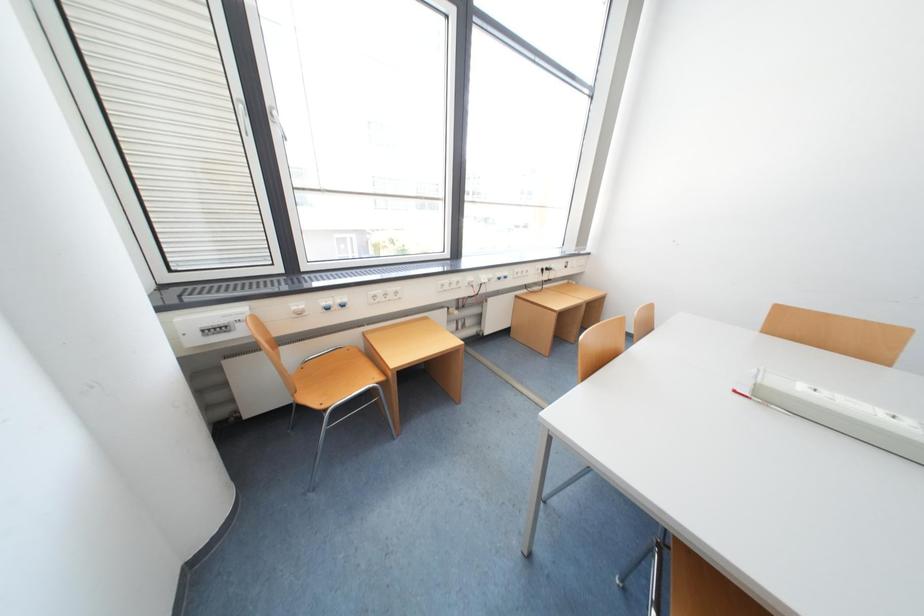
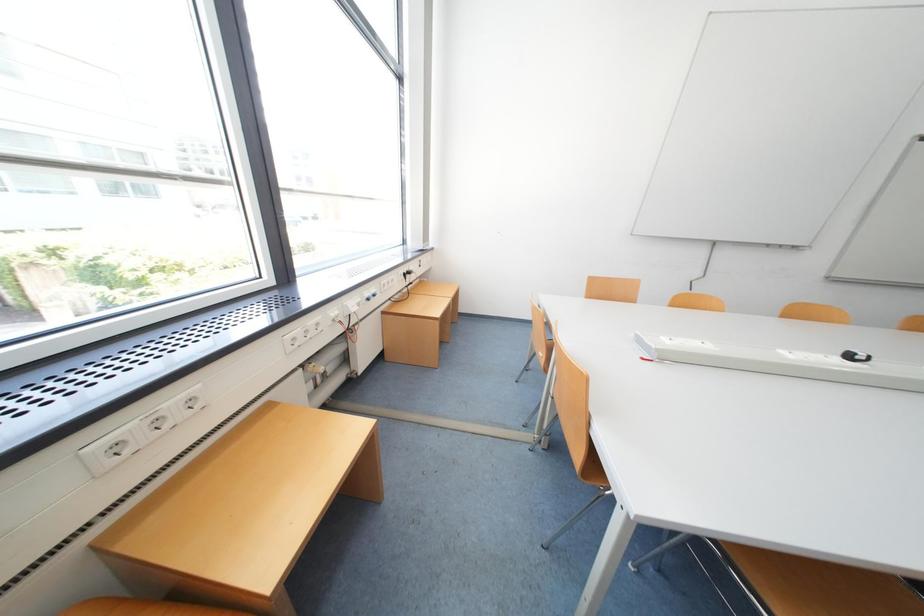
Question: The camera is either moving clockwise (left) or counter-clockwise (right) around the object. The first image is from the beginning of the video and the second image is from the end. Is the camera moving left or right when shooting the video?

Choices:
 (A) Left
 (B) Right

Answer: (A)